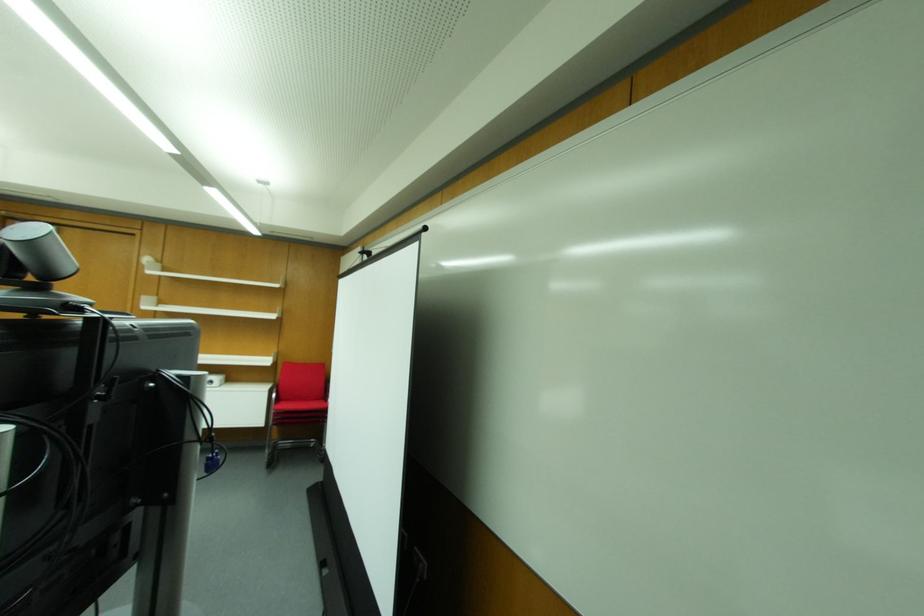
Where is `cylindrical webcam`? cylindrical webcam is located at coordinates (40, 251).